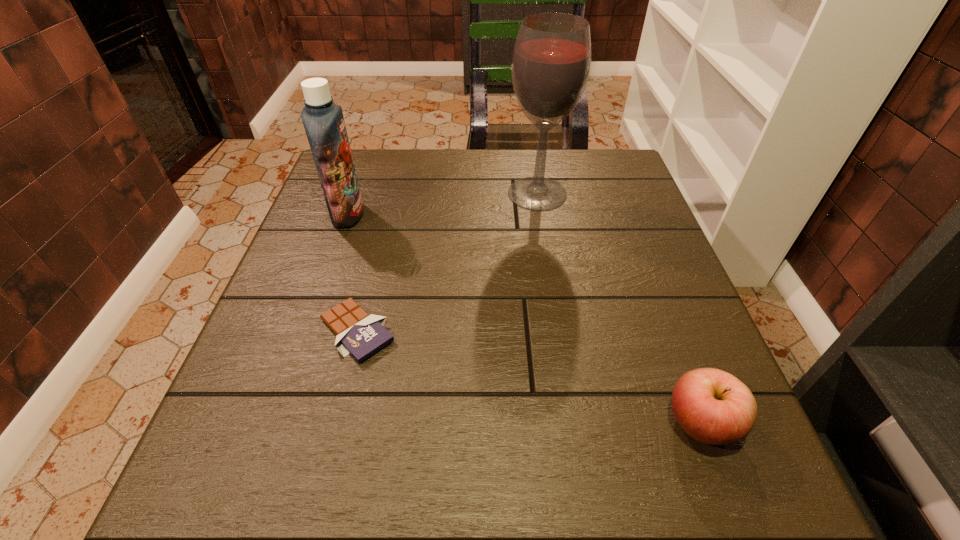
This screenshot has height=540, width=960. In the image, there is a desktop. What are the coordinates of `vacant region at the far right corner` in the screenshot? It's located at (591, 160).

Locate an element on the screen. The height and width of the screenshot is (540, 960). free space between the alcohol and the shampoo is located at coordinates (443, 204).

I want to click on vacant area that lies between the shampoo and the second shortest object, so click(524, 319).

Locate an element on the screen. free area in between the second nearest object and the shampoo is located at coordinates (352, 273).

The width and height of the screenshot is (960, 540). In order to click on free space that is in between the alcohol and the rightmost object in this screenshot , I will do `click(619, 308)`.

Where is `free space between the nearest object and the second object from right to left`? The image size is (960, 540). free space between the nearest object and the second object from right to left is located at coordinates (619, 308).

What are the coordinates of `unoccupied position between the nearest object and the tallest object` in the screenshot? It's located at (619, 308).

Where is `unoccupied area between the second shortest object and the tallest object`? unoccupied area between the second shortest object and the tallest object is located at coordinates (619, 308).

I want to click on free space between the second object from right to left and the nearest object, so tap(619, 308).

Find the location of a particular element. unoccupied position between the tallest object and the shortest object is located at coordinates (447, 262).